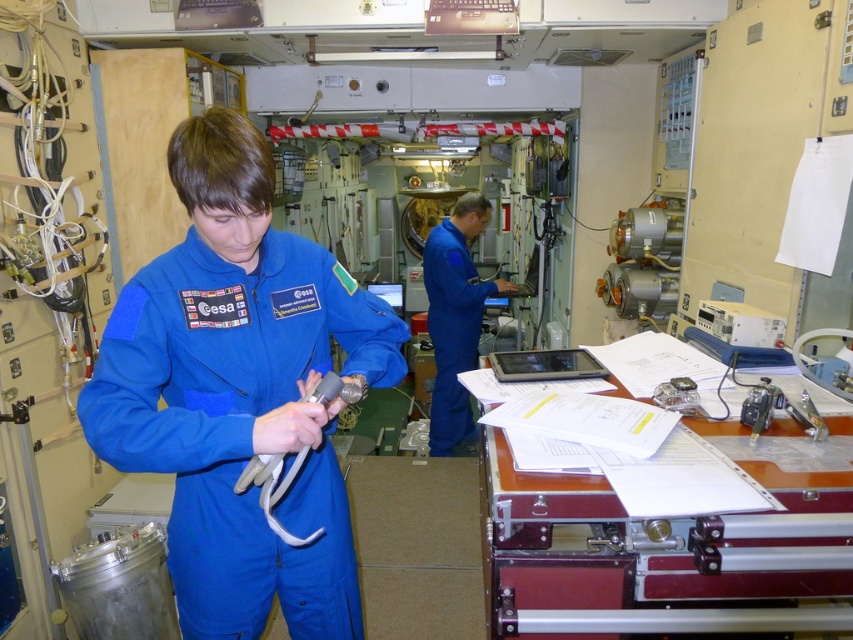
Between blue fabric astronaut suit at center and blue smooth jumpsuit at center, which one is positioned lower?

blue fabric astronaut suit at center is below.

Looking at this image, between blue fabric astronaut suit at center and blue smooth jumpsuit at center, which one appears on the left side from the viewer's perspective?

Positioned to the left is blue fabric astronaut suit at center.

Who is more distant from viewer, (254, 209) or (456, 429)?

The point (456, 429) is more distant.

The height and width of the screenshot is (640, 853). In order to click on blue fabric astronaut suit at center in this screenshot , I will do `click(239, 392)`.

Is blue smooth jumpsuit at center behind white rubber tube at center?

Yes, blue smooth jumpsuit at center is further from the viewer.

Which is in front, point (444, 444) or point (280, 497)?

Point (280, 497)

Where is `blue smooth jumpsuit at center`? blue smooth jumpsuit at center is located at coordinates (456, 317).

Is metallic silver briefcase at lower right closer to the viewer compared to white rubber tube at center?

Yes, metallic silver briefcase at lower right is in front of white rubber tube at center.

In the scene shown: Is metallic silver briefcase at lower right wider than white rubber tube at center?

Result: Yes, metallic silver briefcase at lower right is wider than white rubber tube at center.

Find the location of `metallic silver briefcase at lower right`. metallic silver briefcase at lower right is located at coordinates (665, 531).